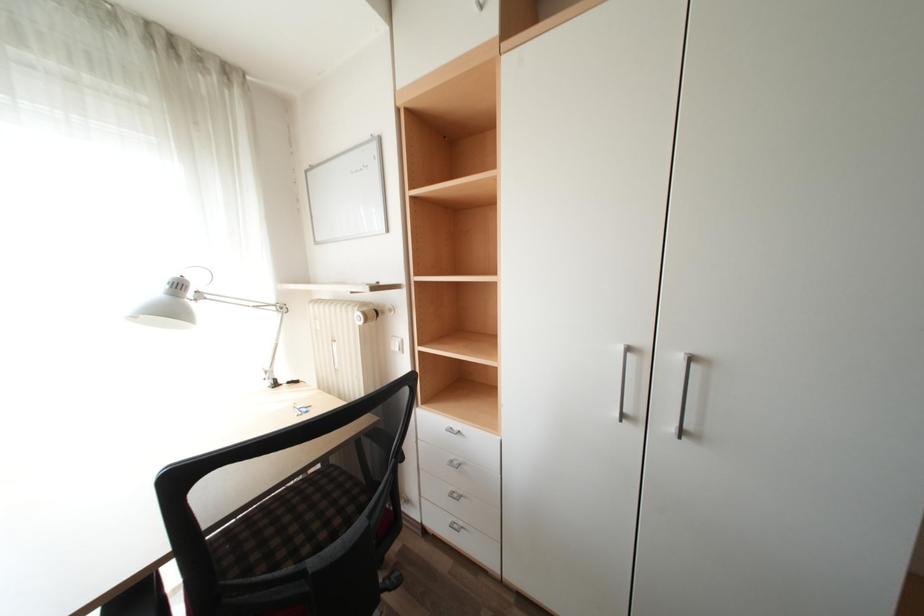
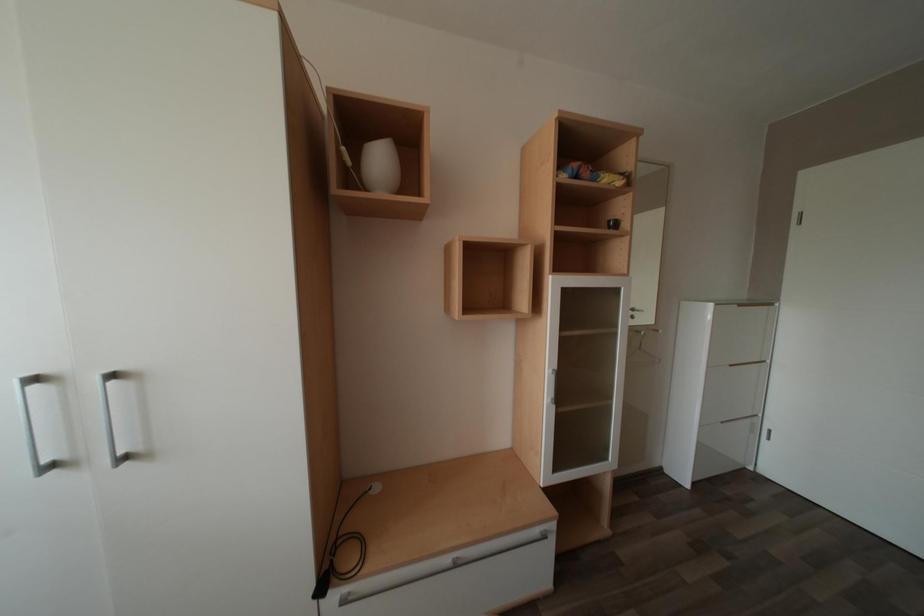
Question: The camera is either moving clockwise (left) or counter-clockwise (right) around the object. The first image is from the beginning of the video and the second image is from the end. Is the camera moving left or right when shooting the video?

Choices:
 (A) Left
 (B) Right

Answer: (A)